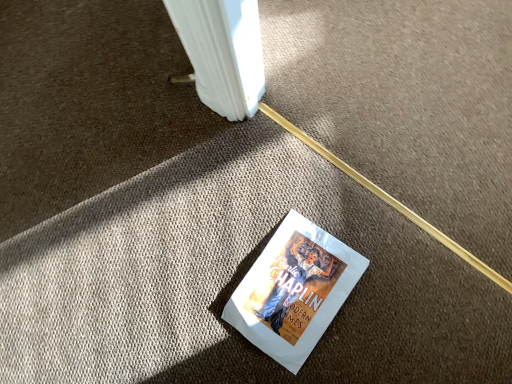
The height and width of the screenshot is (384, 512). I want to click on vacant area to the right of white paper at center, so click(396, 253).